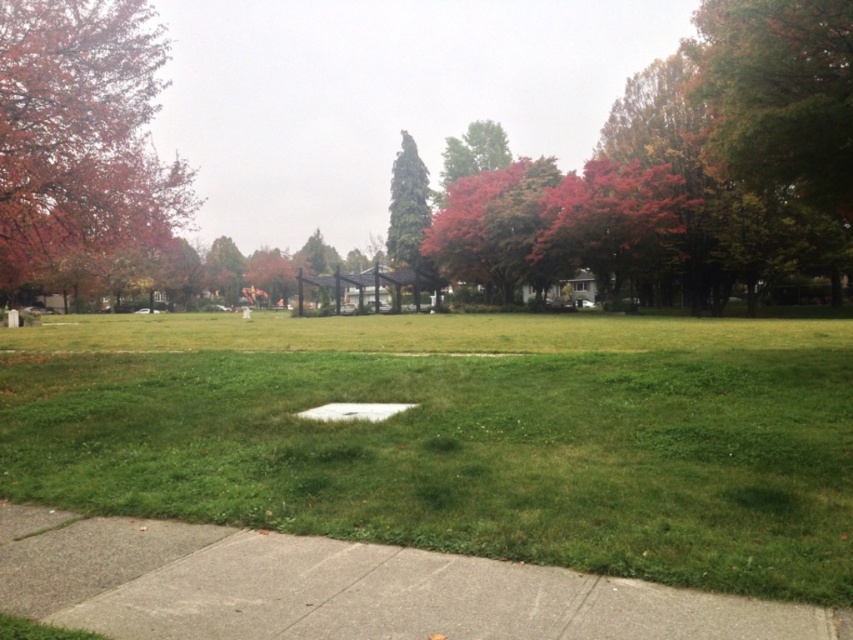
Question: Which of the following is the closest to the observer?

Choices:
 (A) white smooth puddle at center
 (B) reddish-brown bark tree at center
 (C) green glossy tree at center
 (D) green grassy field at center

Answer: (D)

Question: Which of the following is the farthest from the observer?

Choices:
 (A) gray concrete sidewalk at lower left
 (B) shiny red leaves at upper right
 (C) reddish-brown bark tree at left

Answer: (B)

Question: Is gray concrete sidewalk at lower left closer to the viewer compared to reddish-brown bark tree at center?

Choices:
 (A) no
 (B) yes

Answer: (B)

Question: Is reddish-brown bark tree at center above green glossy tree at center?

Choices:
 (A) yes
 (B) no

Answer: (B)

Question: Which point is closer to the camera?

Choices:
 (A) (341, 419)
 (B) (15, 12)
 (C) (541, 227)

Answer: (A)

Question: Does green glossy tree at center appear under white smooth puddle at center?

Choices:
 (A) no
 (B) yes

Answer: (A)